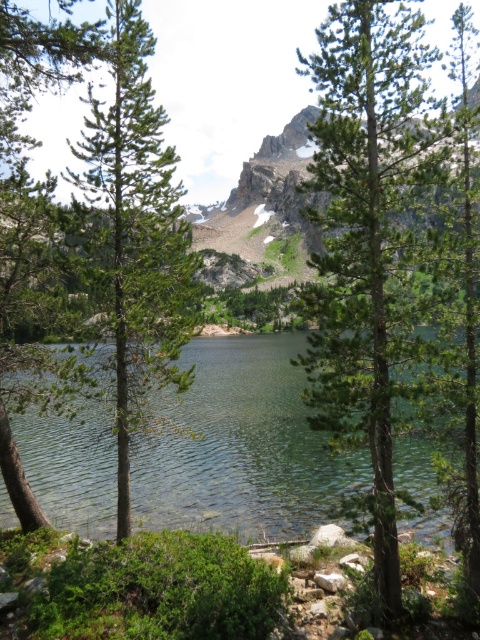
Question: Does green needle-like leaves at center appear under green matte tree at left?

Choices:
 (A) yes
 (B) no

Answer: (A)

Question: Can you confirm if clear water at center is bigger than green needle-like tree at center?

Choices:
 (A) no
 (B) yes

Answer: (A)

Question: Estimate the real-world distances between objects in this image. Which object is closer to the green needle-like leaves at center?

Choices:
 (A) green matte tree at left
 (B) clear water at center

Answer: (B)

Question: Which point is farther to the camera?

Choices:
 (A) green needle-like tree at center
 (B) green needle-like leaves at center
 (C) green matte tree at left

Answer: (A)

Question: Is green needle-like tree at center to the left of green matte tree at left from the viewer's perspective?

Choices:
 (A) no
 (B) yes

Answer: (A)

Question: Among these points, which one is farthest from the camera?

Choices:
 (A) (333, 380)
 (B) (420, 534)

Answer: (B)